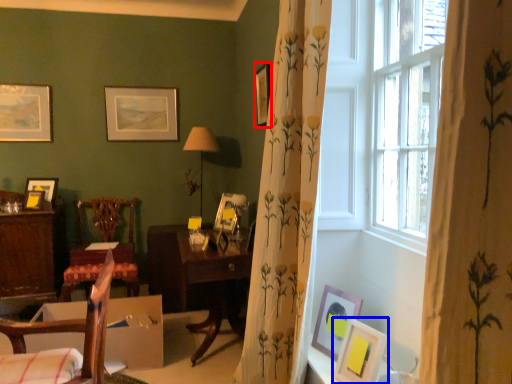
Question: Among these objects, which one is farthest to the camera, picture frame (highlighted by a red box) or picture frame (highlighted by a blue box)?

Choices:
 (A) picture frame
 (B) picture frame

Answer: (A)